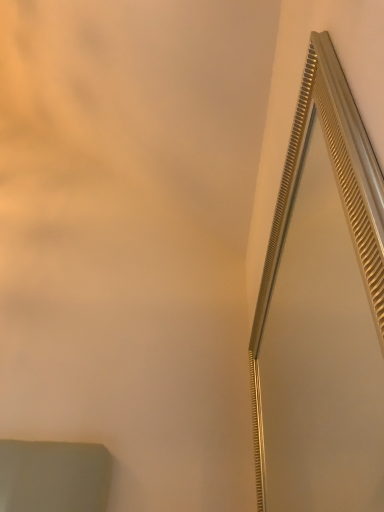
The width and height of the screenshot is (384, 512). Identify the location of gold textured mirror at upper right. 322,342.

What do you see at coordinates (322, 342) in the screenshot? The height and width of the screenshot is (512, 384). I see `gold textured mirror at upper right` at bounding box center [322, 342].

Find the location of `gold textured mirror at upper right`. gold textured mirror at upper right is located at coordinates point(322,342).